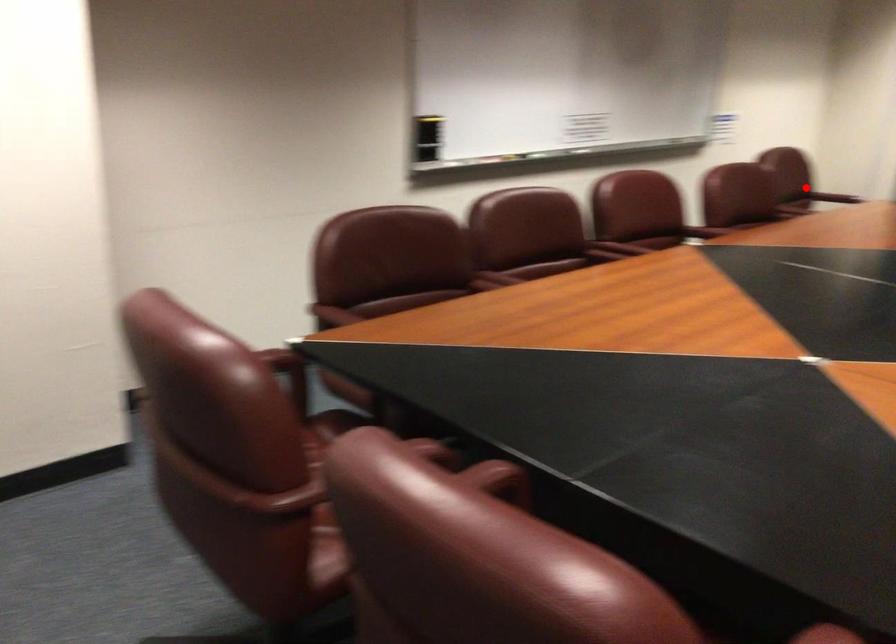
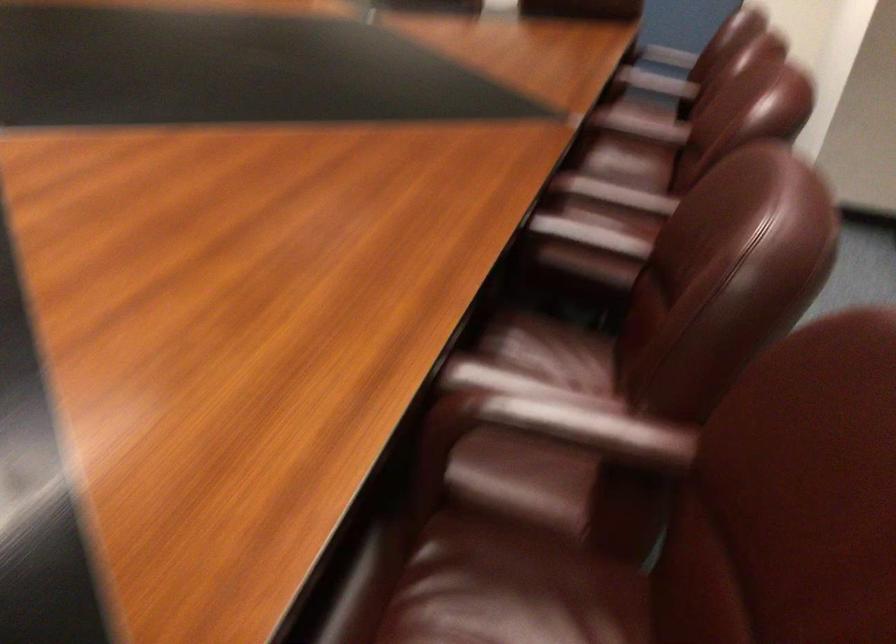
Question: I am providing you with two images of the same scene from different viewpoints. Image1 has a red point marked. In image2, the corresponding 3D location appears at what relative position? Reply with the corresponding letter.

Choices:
 (A) Closer
 (B) Farther

Answer: (A)